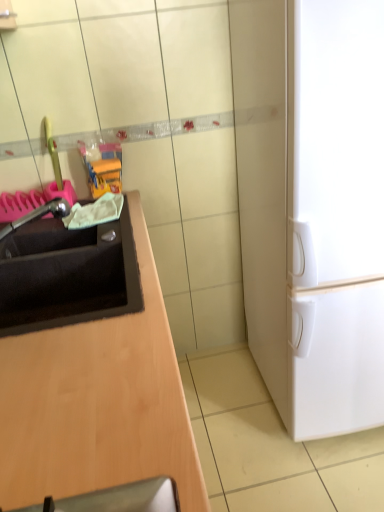
Question: Based on their sizes in the image, would you say satin nickel faucet at left is bigger or smaller than black matte sink at left?

Choices:
 (A) big
 (B) small

Answer: (B)

Question: Does point (8, 230) appear closer or farther from the camera than point (125, 300)?

Choices:
 (A) farther
 (B) closer

Answer: (A)

Question: Estimate the real-world distances between objects in this image. Which object is closer to the white matte refrigerator at right?

Choices:
 (A) satin nickel faucet at left
 (B) black matte sink at left

Answer: (B)

Question: Considering the real-world distances, which object is closest to the black matte sink at left?

Choices:
 (A) satin nickel faucet at left
 (B) white matte refrigerator at right

Answer: (A)